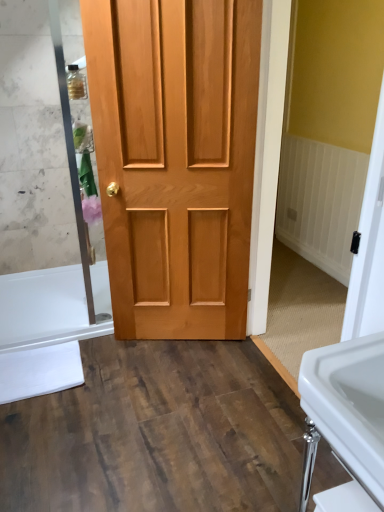
Find the location of `vacant region above white glossy bathtub at lower left (from a real-world perspective)`. vacant region above white glossy bathtub at lower left (from a real-world perspective) is located at coordinates (47, 302).